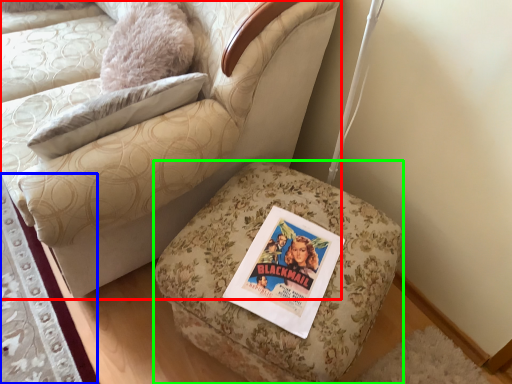
Question: Based on their relative distances, which object is nearer to chair (highlighted by a red box)? Choose from mat (highlighted by a blue box) and furniture (highlighted by a green box).

Choices:
 (A) mat
 (B) furniture

Answer: (B)